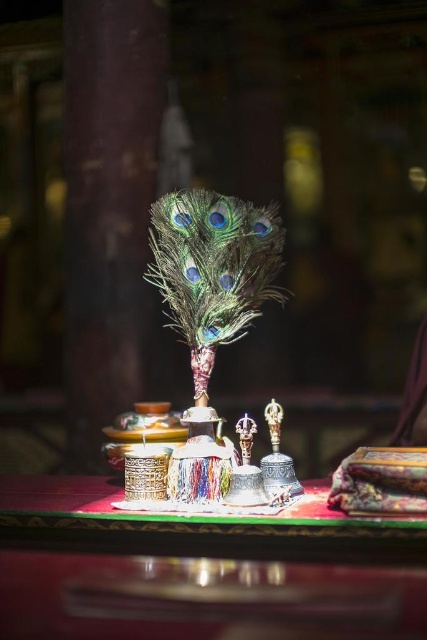
You are an interior designer planning to place a new decorative item on the shiny dark wood table at center and the metallic bell at center. Which surface has more space available for placing additional items?

The shiny dark wood table at center has more space available because its width surpasses that of the metallic bell at center.

What are the coordinates of the shiny dark wood table at center?

The shiny dark wood table at center is located at point (199, 570).